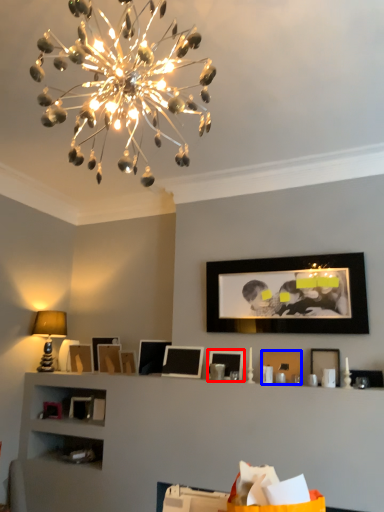
Question: Among these objects, which one is nearest to the camera, picture frame (highlighted by a red box) or picture frame (highlighted by a blue box)?

Choices:
 (A) picture frame
 (B) picture frame

Answer: (B)